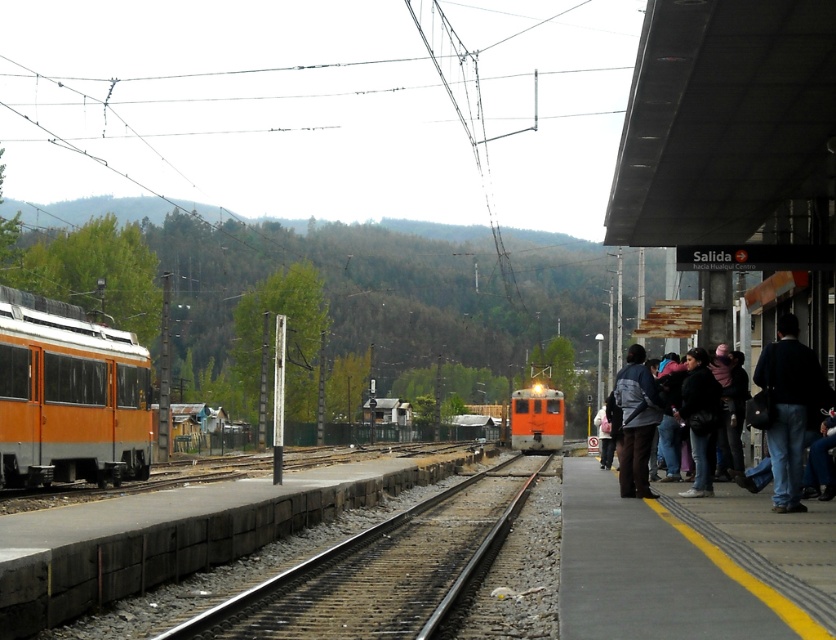
Does point (421, 632) lie behind point (786, 500)?

No.

Does smooth concrete train track at center appear over dark blue jeans at right?

No, smooth concrete train track at center is not above dark blue jeans at right.

You are a GUI agent. You are given a task and a screenshot of the screen. Output one action in this format:
    pyautogui.click(x=<x>, y=<y>)
    Task: Click on the smooth concrete train track at center
    
    Given the screenshot: What is the action you would take?
    pyautogui.click(x=376, y=572)

Who is higher up, smooth concrete train track at center or orange matte train at left?

orange matte train at left is higher up.

Which of these two, smooth concrete train track at center or orange matte train at left, stands shorter?

smooth concrete train track at center

What do you see at coordinates (376, 572) in the screenshot?
I see `smooth concrete train track at center` at bounding box center [376, 572].

At what (x,y) coordinates should I click in order to perform the action: click on smooth concrete train track at center. Please return your answer as a coordinate pair (x, y). The image size is (836, 640). Looking at the image, I should click on (376, 572).

Who is higher up, orange matte train at left or dark gray jacket at center?

dark gray jacket at center

Looking at this image, who is more distant from viewer, (143, 460) or (623, 458)?

The point (143, 460) is more distant.

Does point (4, 330) come behind point (640, 444)?

Yes, point (4, 330) is behind point (640, 444).

You are a GUI agent. You are given a task and a screenshot of the screen. Output one action in this format:
    pyautogui.click(x=<x>, y=<y>)
    Task: Click on the orange matte train at left
    The width and height of the screenshot is (836, 640).
    Given the screenshot: What is the action you would take?
    pyautogui.click(x=69, y=396)